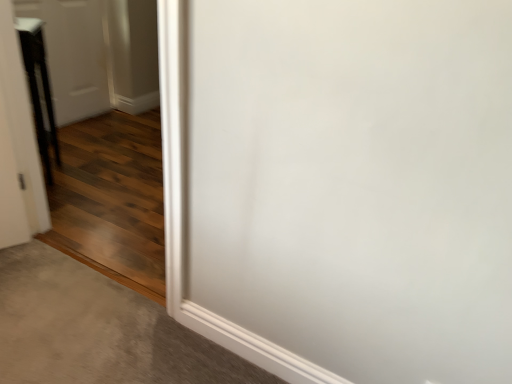
What do you see at coordinates (97, 330) in the screenshot? I see `gray carpet at lower left` at bounding box center [97, 330].

In order to face white glossy door at upper left, marked as the 2th door in a front-to-back arrangement, should I rotate leftwards or rightwards?

You should rotate left by 22.761 degrees.

This screenshot has width=512, height=384. What do you see at coordinates (18, 146) in the screenshot?
I see `black glossy door at left, positioned as the first door in front-to-back order` at bounding box center [18, 146].

At what (x,y) coordinates should I click in order to perform the action: click on gray carpet at lower left. Please return your answer as a coordinate pair (x, y). Image resolution: width=512 pixels, height=384 pixels. Looking at the image, I should click on (97, 330).

Based on their positions, is gray carpet at lower left located to the left or right of black glossy door at left, positioned as the first door in front-to-back order?

gray carpet at lower left is positioned on black glossy door at left, positioned as the first door in front-to-back order,'s right side.

Is gray carpet at lower left oriented away from black glossy door at left, positioned as the first door in front-to-back order?

No, black glossy door at left, positioned as the first door in front-to-back order, is not at the back of gray carpet at lower left.

Is gray carpet at lower left in front of black glossy door at left, the 2th door viewed from the back?

That is True.

Is black glossy door at left, the 2th door viewed from the back, surrounded by gray carpet at lower left?

No, black glossy door at left, the 2th door viewed from the back, is located outside of gray carpet at lower left.

Are white glossy door at upper left, marked as the 2th door in a front-to-back arrangement, and gray carpet at lower left located far from each other?

Yes.

Is white glossy door at upper left, the first door in the back-to-front sequence, turned away from gray carpet at lower left?

No, white glossy door at upper left, the first door in the back-to-front sequence, is not facing the opposite direction of gray carpet at lower left.

Does white glossy door at upper left, the first door in the back-to-front sequence, have a greater height compared to gray carpet at lower left?

Correct, white glossy door at upper left, the first door in the back-to-front sequence, is much taller as gray carpet at lower left.

Consider the image. From a real-world perspective, which is physically below, white glossy door at upper left, marked as the 2th door in a front-to-back arrangement, or gray carpet at lower left?

gray carpet at lower left, from a real-world perspective.

Can white glossy door at upper left, marked as the 2th door in a front-to-back arrangement, be found inside black glossy door at left, positioned as the first door in front-to-back order?

No, black glossy door at left, positioned as the first door in front-to-back order, does not contain white glossy door at upper left, marked as the 2th door in a front-to-back arrangement.

Is black glossy door at left, the 2th door viewed from the back, smaller than white glossy door at upper left, marked as the 2th door in a front-to-back arrangement?

Indeed, black glossy door at left, the 2th door viewed from the back, has a smaller size compared to white glossy door at upper left, marked as the 2th door in a front-to-back arrangement.

From the image's perspective, is gray carpet at lower left positioned above or below white glossy door at upper left, the first door in the back-to-front sequence?

Clearly, from the image's perspective, gray carpet at lower left is below white glossy door at upper left, the first door in the back-to-front sequence.

Is the surface of gray carpet at lower left in direct contact with white glossy door at upper left, marked as the 2th door in a front-to-back arrangement?

gray carpet at lower left is not next to white glossy door at upper left, marked as the 2th door in a front-to-back arrangement, and they're not touching.

Is point (81, 342) positioned before point (68, 5)?

Yes, point (81, 342) is in front of point (68, 5).

I want to click on concrete directly beneath the black glossy door at left, the 2th door viewed from the back (from a real-world perspective), so click(x=97, y=330).

From a real-world perspective, relative to gray carpet at lower left, is black glossy door at left, positioned as the first door in front-to-back order, vertically above or below?

black glossy door at left, positioned as the first door in front-to-back order, is above gray carpet at lower left.

Which is further, (28, 130) or (90, 282)?

The point (28, 130) is more distant.

Based on the photo, based on their sizes in the image, would you say black glossy door at left, the 2th door viewed from the back, is bigger or smaller than gray carpet at lower left?

black glossy door at left, the 2th door viewed from the back, is bigger than gray carpet at lower left.

Considering the positions of points (84, 103) and (16, 60), is point (84, 103) farther from camera compared to point (16, 60)?

That is True.

From a real-world perspective, who is located higher, white glossy door at upper left, marked as the 2th door in a front-to-back arrangement, or black glossy door at left, positioned as the first door in front-to-back order?

white glossy door at upper left, marked as the 2th door in a front-to-back arrangement, is physically above.

From the image's perspective, which one is positioned higher, white glossy door at upper left, the first door in the back-to-front sequence, or black glossy door at left, the 2th door viewed from the back?

white glossy door at upper left, the first door in the back-to-front sequence, from the image's perspective.

Are white glossy door at upper left, marked as the 2th door in a front-to-back arrangement, and black glossy door at left, the 2th door viewed from the back, far apart?

Yes.

The width and height of the screenshot is (512, 384). Identify the location of concrete on the right of black glossy door at left, the 2th door viewed from the back. (97, 330).

You are a GUI agent. You are given a task and a screenshot of the screen. Output one action in this format:
    pyautogui.click(x=<x>, y=<y>)
    Task: Click on the concrete located below the white glossy door at upper left, the first door in the back-to-front sequence (from the image's perspective)
    
    Given the screenshot: What is the action you would take?
    pyautogui.click(x=97, y=330)

From the image, which object appears to be nearer to black glossy door at left, the 2th door viewed from the back, white glossy door at upper left, marked as the 2th door in a front-to-back arrangement, or gray carpet at lower left?

gray carpet at lower left.

Considering their positions, is black glossy door at left, the 2th door viewed from the back, positioned further to white glossy door at upper left, the first door in the back-to-front sequence, than gray carpet at lower left?

gray carpet at lower left is further to white glossy door at upper left, the first door in the back-to-front sequence.

Looking at the image, which one is located closer to gray carpet at lower left, black glossy door at left, the 2th door viewed from the back, or white glossy door at upper left, marked as the 2th door in a front-to-back arrangement?

Based on the image, black glossy door at left, the 2th door viewed from the back, appears to be nearer to gray carpet at lower left.

Considering their positions, is gray carpet at lower left positioned closer to black glossy door at left, positioned as the first door in front-to-back order, than white glossy door at upper left, marked as the 2th door in a front-to-back arrangement?

Based on the image, gray carpet at lower left appears to be nearer to black glossy door at left, positioned as the first door in front-to-back order.

Looking at this image, from the image, which object appears to be farther from gray carpet at lower left, white glossy door at upper left, the first door in the back-to-front sequence, or black glossy door at left, positioned as the first door in front-to-back order?

Among the two, white glossy door at upper left, the first door in the back-to-front sequence, is located further to gray carpet at lower left.

Based on the photo, looking at the image, which one is located closer to white glossy door at upper left, marked as the 2th door in a front-to-back arrangement, gray carpet at lower left or black glossy door at left, positioned as the first door in front-to-back order?

black glossy door at left, positioned as the first door in front-to-back order, lies closer to white glossy door at upper left, marked as the 2th door in a front-to-back arrangement, than the other object.

The width and height of the screenshot is (512, 384). Identify the location of door between gray carpet at lower left and white glossy door at upper left, the first door in the back-to-front sequence, along the z-axis. (18, 146).